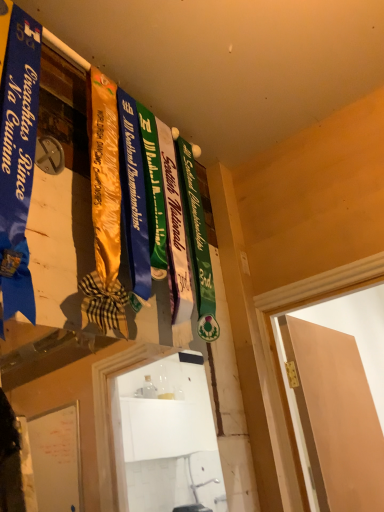
Where is `matte peach door at right`? matte peach door at right is located at coordinates (336, 417).

What do you see at coordinates (336, 417) in the screenshot?
I see `matte peach door at right` at bounding box center [336, 417].

Describe the element at coordinates (18, 160) in the screenshot. This screenshot has height=512, width=384. I see `blue satin ribbon at left` at that location.

The width and height of the screenshot is (384, 512). I want to click on blue satin ribbon at left, so click(18, 160).

What is the approximate height of blue satin ribbon at left?

It is 37.10 inches.

In order to face blue satin ribbon at left, should I rotate leftwards or rightwards?

To face it directly, rotate left by 21.833 degrees.

Find the location of a particular element. The width and height of the screenshot is (384, 512). matte peach door at right is located at coordinates (336, 417).

Does blue satin ribbon at left appear on the left side of matte peach door at right?

Yes, blue satin ribbon at left is to the left of matte peach door at right.

Which object is further away from the camera, blue satin ribbon at left or matte peach door at right?

matte peach door at right.

Considering the positions of points (23, 65) and (370, 507), is point (23, 65) closer to camera compared to point (370, 507)?

Yes, it is in front of point (370, 507).

From the image's perspective, is blue satin ribbon at left below matte peach door at right?

Actually, blue satin ribbon at left appears above matte peach door at right in the image.

From a real-world perspective, who is located lower, blue satin ribbon at left or matte peach door at right?

From a 3D spatial view, matte peach door at right is below.

Considering the sizes of objects blue satin ribbon at left and matte peach door at right in the image provided, who is thinner, blue satin ribbon at left or matte peach door at right?

Thinner between the two is matte peach door at right.

Who is shorter, blue satin ribbon at left or matte peach door at right?

matte peach door at right.

Which of these two, blue satin ribbon at left or matte peach door at right, is smaller?

blue satin ribbon at left.

Is blue satin ribbon at left inside or outside of matte peach door at right?

The correct answer is: outside.

Is blue satin ribbon at left with matte peach door at right?

No.

Is matte peach door at right at the back of blue satin ribbon at left?

No, blue satin ribbon at left's orientation is not away from matte peach door at right.

How many degrees apart are the facing directions of blue satin ribbon at left and matte peach door at right?

4.92 degrees separate the facing orientations of blue satin ribbon at left and matte peach door at right.

In order to click on door lying on the right of blue satin ribbon at left in this screenshot , I will do `click(336, 417)`.

Is matte peach door at right at the right side of blue satin ribbon at left?

Yes.

Which object is further away from the camera taking this photo, matte peach door at right or blue satin ribbon at left?

matte peach door at right is further away from the camera.

Considering the positions of points (331, 497) and (30, 140), is point (331, 497) closer to camera compared to point (30, 140)?

No, it is behind (30, 140).

In the scene shown: From the image's perspective, which object appears higher, matte peach door at right or blue satin ribbon at left?

blue satin ribbon at left is shown above in the image.

From a real-world perspective, between matte peach door at right and blue satin ribbon at left, who is vertically higher?

In real-world perspective, blue satin ribbon at left is above.

Is matte peach door at right thinner than blue satin ribbon at left?

Yes.

Does matte peach door at right have a greater height compared to blue satin ribbon at left?

No.

In terms of size, does matte peach door at right appear bigger or smaller than blue satin ribbon at left?

matte peach door at right is bigger than blue satin ribbon at left.

Is blue satin ribbon at left inside matte peach door at right?

Actually, blue satin ribbon at left is outside matte peach door at right.

Are matte peach door at right and blue satin ribbon at left located far from each other?

Yes, matte peach door at right and blue satin ribbon at left are located far from each other.

Is matte peach door at right oriented away from blue satin ribbon at left?

No, matte peach door at right's orientation is not away from blue satin ribbon at left.

What's the angular difference between matte peach door at right and blue satin ribbon at left's facing directions?

4.92 degrees separate the facing orientations of matte peach door at right and blue satin ribbon at left.

Locate an element on the screen. door that is below the blue satin ribbon at left (from the image's perspective) is located at coordinates (336, 417).

At what (x,y) coordinates should I click in order to perform the action: click on door beneath the blue satin ribbon at left (from a real-world perspective). Please return your answer as a coordinate pair (x, y). The image size is (384, 512). Looking at the image, I should click on (336, 417).

Image resolution: width=384 pixels, height=512 pixels. I want to click on door on the right of blue satin ribbon at left, so click(x=336, y=417).